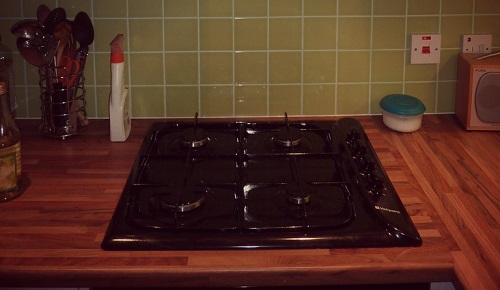
The width and height of the screenshot is (500, 290). What are the coordinates of `wooden counters` in the screenshot? It's located at (64, 194), (461, 186).